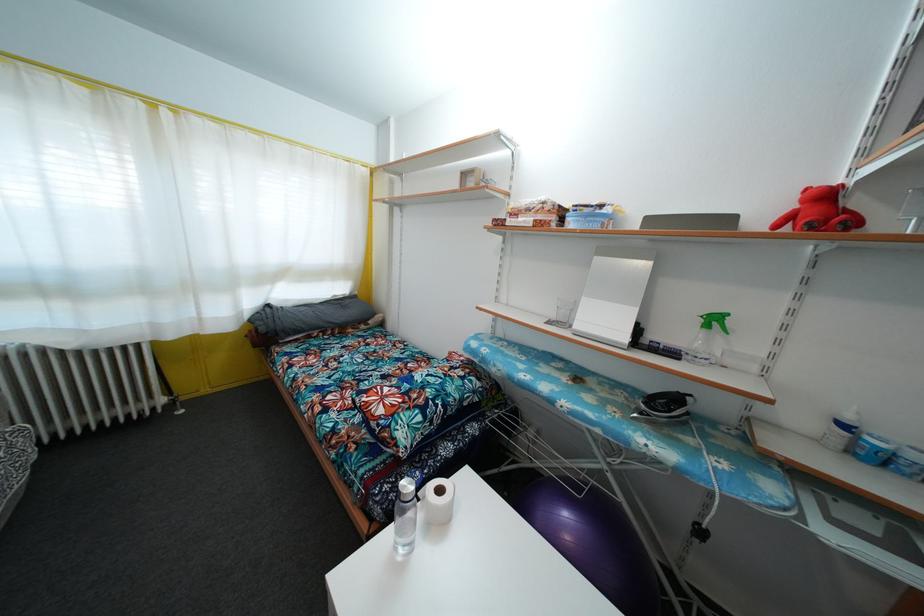
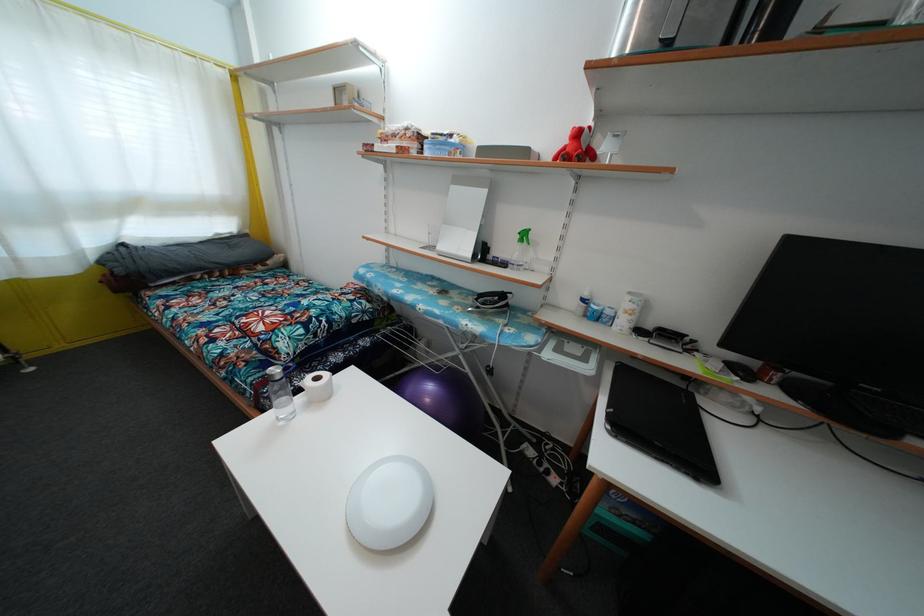
Locate, in the second image, the point that corresponds to point (444, 498) in the first image.

(321, 386)